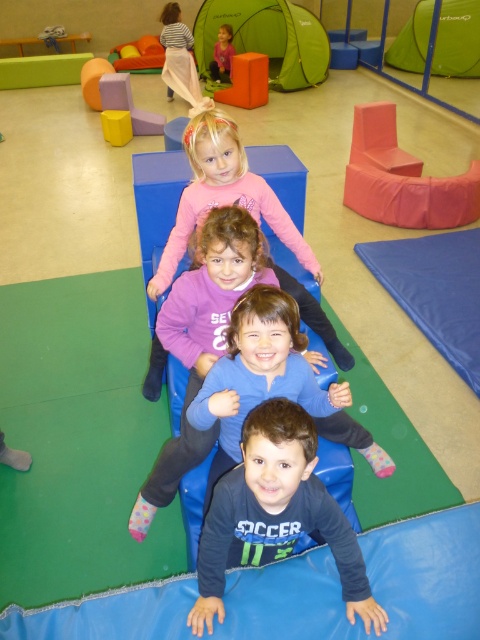
You are a photographer taking a picture of the blue cotton shirt at center and the pink fleece sweater at center. Which one will appear larger in your photo?

The blue cotton shirt at center will appear larger in the photo because it is closer to the viewer than the pink fleece sweater at center.

You are a photographer standing in the play area and want to take a photo of the dark blue jersey at center and the blue cotton shirt at center. Which one will appear larger in the photo?

The dark blue jersey at center will appear larger in the photo because it is closer to the viewer than the blue cotton shirt at center.

Based on the photo, you are a parent trying to find your child who is wearing a dark blue jersey at center and a blue cotton shirt at center. Based on the scene description, which clothing item is closer to the front of the slide?

The dark blue jersey at center is positioned under the blue cotton shirt at center, so the blue cotton shirt at center is closer to the front of the slide.